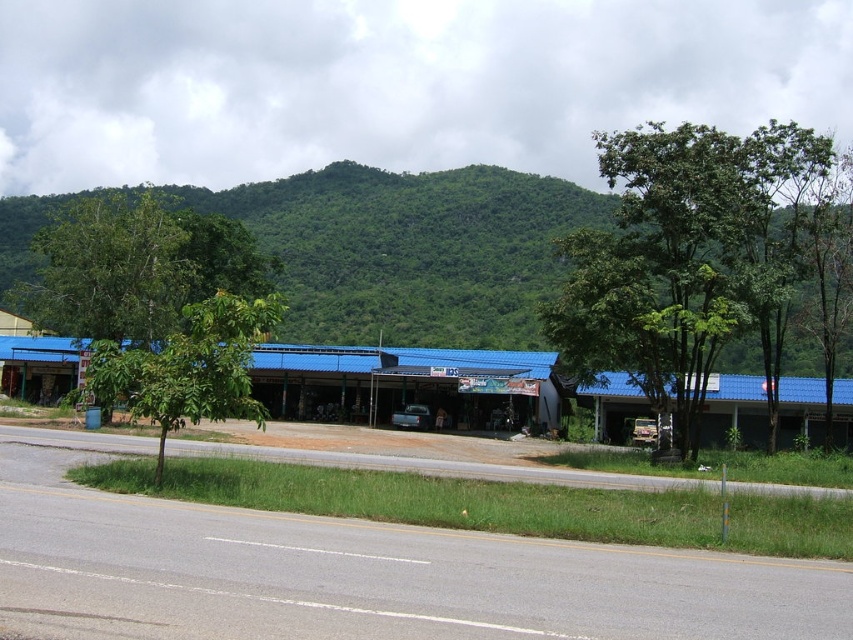
Question: Is green leafy tree at center to the right of green leafy tree at left from the viewer's perspective?

Choices:
 (A) no
 (B) yes

Answer: (B)

Question: Which is nearer to the green leafy mountain at upper center?

Choices:
 (A) green leafy tree at center
 (B) green leafy tree at left

Answer: (A)

Question: Which of the following is the farthest from the observer?

Choices:
 (A) (651, 141)
 (B) (606, 209)
 (C) (241, 300)

Answer: (B)

Question: Is green leafy mountain at upper center positioned behind green leafy tree at left?

Choices:
 (A) no
 (B) yes

Answer: (B)

Question: Which point is farther to the camera?

Choices:
 (A) green leafy tree at left
 (B) green leafy mountain at upper center

Answer: (B)

Question: Does green leafy mountain at upper center have a greater width compared to green leafy tree at center?

Choices:
 (A) no
 (B) yes

Answer: (B)